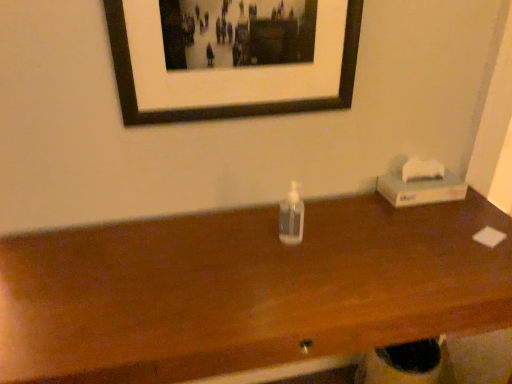
Image resolution: width=512 pixels, height=384 pixels. What are the coordinates of `free spot in front of white cardboard tissue box at right` in the screenshot? It's located at click(x=449, y=228).